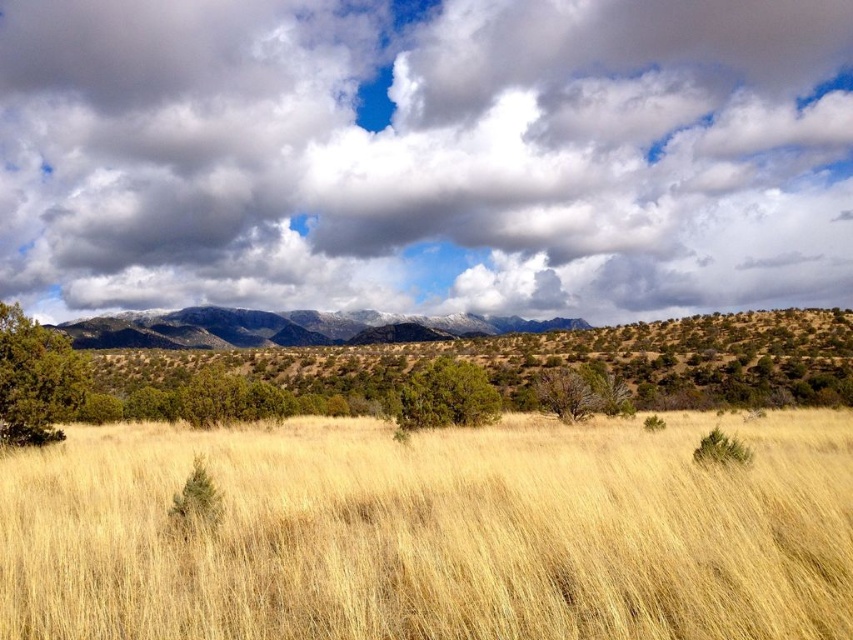
In the scene shown: You are standing in the open landscape and want to walk from the point at coordinates (x=44, y=433) to the point at coordinates (x=448, y=401). Which direction should you face to start moving towards the second point?

Since point (x=44, y=433) is closer to the viewer than point (x=448, y=401), you should face away from the mountains to move towards the second point.

You are a gardener planning to transplant the green shrub at center and the green textured bush at left to a new garden plot. Based on their sizes, which one requires a larger planting hole?

The green shrub at center requires a larger planting hole since it might be wider than the green textured bush at left according to the description.

You are standing in the middle of the field of tall grass. You look up and see the cloudy sky at upper center and the green matte bush at center. Which object is higher from the ground?

The cloudy sky at upper center is higher from the ground than the green matte bush at center because it is located above it.